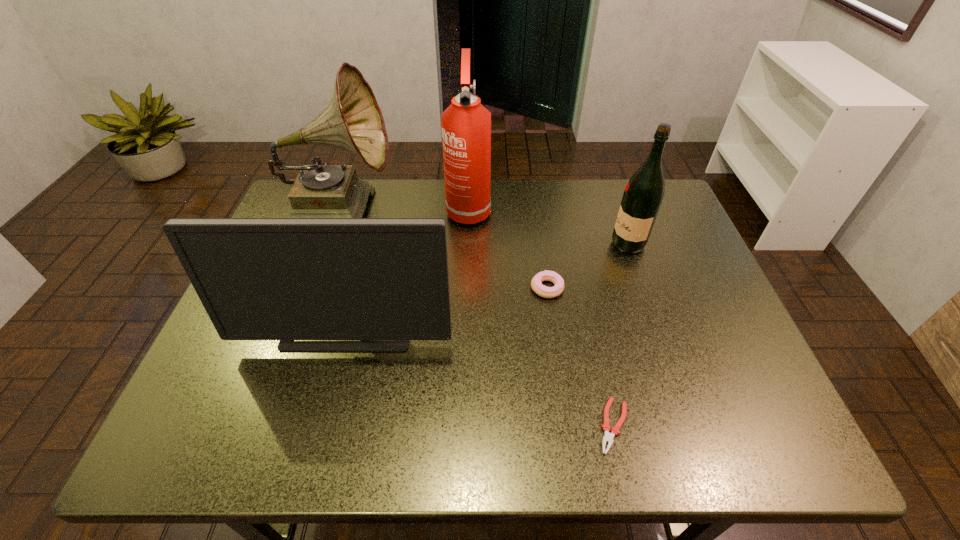
At what (x,y) coordinates should I click in order to perform the action: click on free region that satisfies the following two spatial constraints: 1. at the nozzle of the second object from right to left; 2. on the left side of the fire extinguisher. Please return your answer as a coordinate pair (x, y). Looking at the image, I should click on (462, 426).